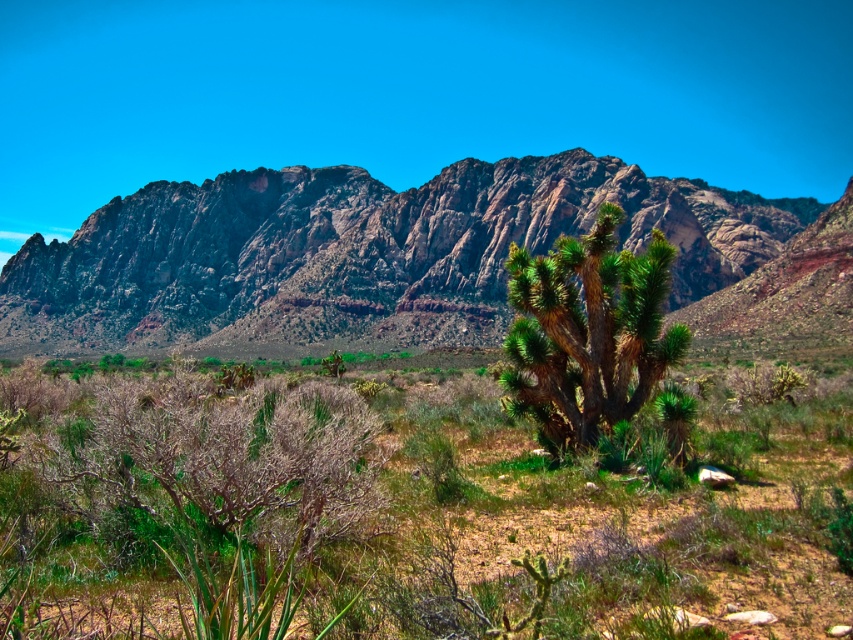
You are a hiker in the desert and need to determine which plant takes up more space between the green leafy bush at center and the green spiky cactus at center. Which one should you choose?

The green spiky cactus at center occupies more space than the green leafy bush at center, so you should choose the green spiky cactus at center.

You are a hiker trying to navigate through the desert. You see the green leafy bush at center and the rugged rock mountain range at upper center. Which object is closer to you?

The green leafy bush at center is closer to you because it is positioned in the foreground compared to the rugged rock mountain range at upper center, which is in the background.